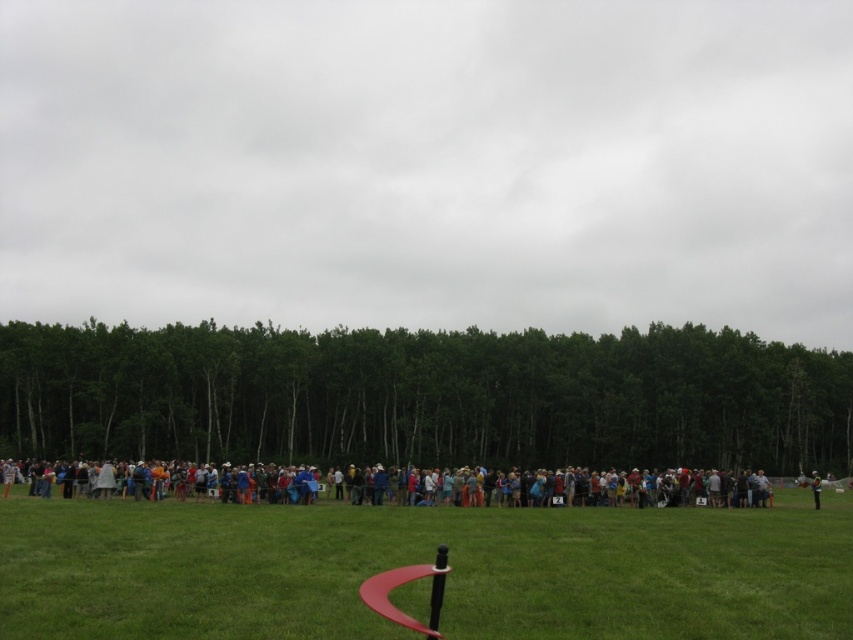
You are a participant in the event and you see the green grass at center and the reflective silver helmet at lower right. Which object is positioned more to the right side?

The reflective silver helmet at lower right is positioned more to the right side than the green grass at center.

You are a photographer trying to capture a photo of the multicolored clothing at center and the reflective silver helmet at lower right. Based on their positions, which object should you adjust your camera angle to focus on first if you want to include both in the frame?

The multicolored clothing at center is positioned on the left side of the reflective silver helmet at lower right, so you should focus on the multicolored clothing at center first to ensure both are in the frame.